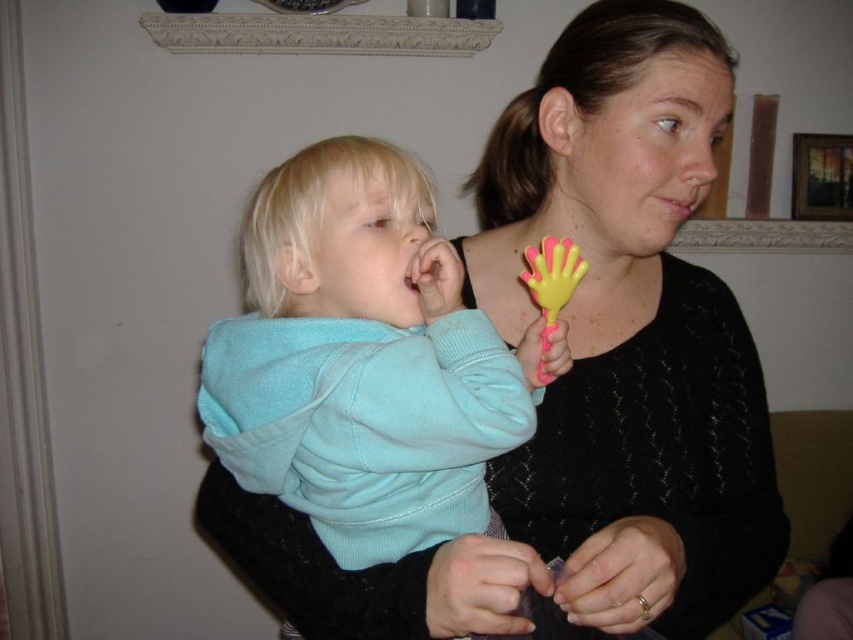
Question: Among these points, which one is nearest to the camera?

Choices:
 (A) (573, 259)
 (B) (233, 448)
 (C) (762, 520)

Answer: (B)

Question: Which point is closer to the camera taking this photo?

Choices:
 (A) (440, 371)
 (B) (631, 109)
 (C) (540, 268)

Answer: (A)

Question: Does matte black sweater at center have a greater width compared to yellow rubber toy at center?

Choices:
 (A) yes
 (B) no

Answer: (A)

Question: Considering the relative positions of matte black sweater at center and light blue fleece sweater at center in the image provided, where is matte black sweater at center located with respect to light blue fleece sweater at center?

Choices:
 (A) above
 (B) below

Answer: (A)

Question: Which of the following is the closest to the observer?

Choices:
 (A) (381, 541)
 (B) (524, 275)
 (C) (695, 504)

Answer: (A)

Question: Can you confirm if light blue fleece sweater at center is smaller than yellow rubber toy at center?

Choices:
 (A) yes
 (B) no

Answer: (B)